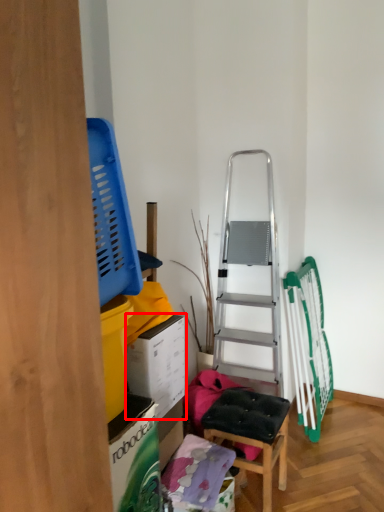
Question: From the image, what is the correct spatial relationship of box (annotated by the red box) in relation to furniture?

Choices:
 (A) left
 (B) right

Answer: (A)